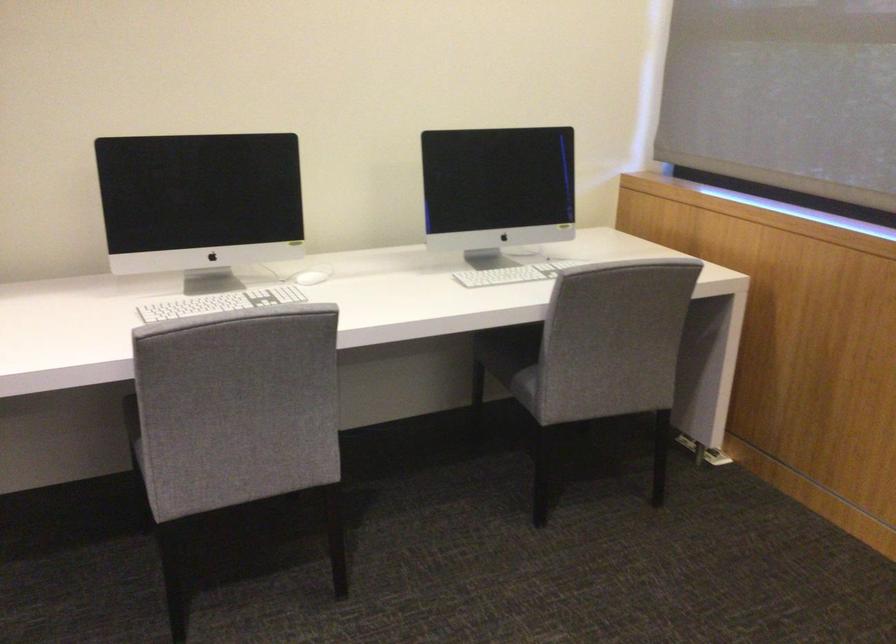
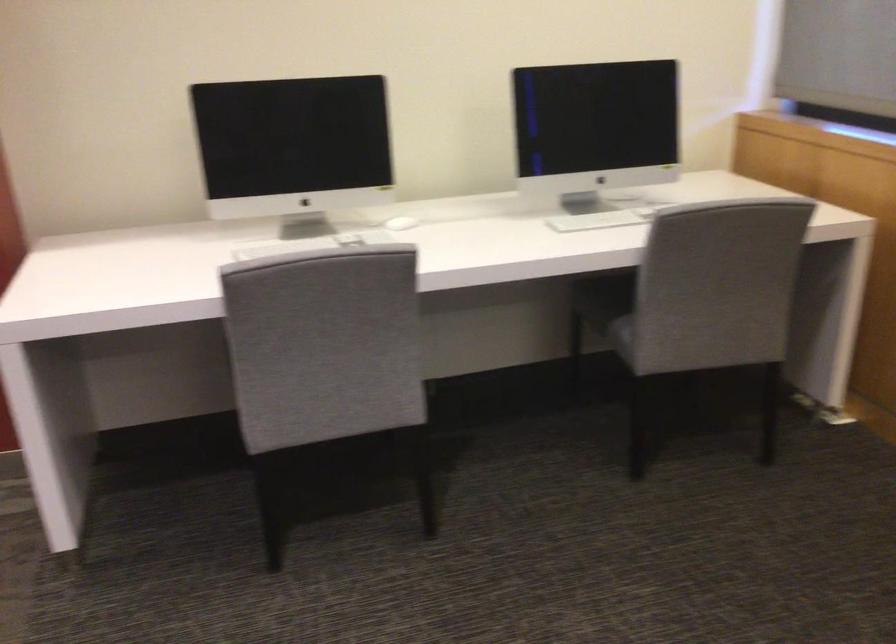
The images are taken continuously from a first-person perspective. In which direction are you moving?

The cameraman walked toward right, forward.